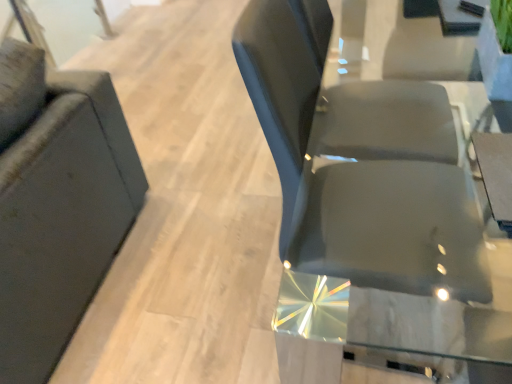
What are the coordinates of `unoccupied region to the right of matte black chair at left, which is counted as the first chair, starting from the left` in the screenshot? It's located at (190, 245).